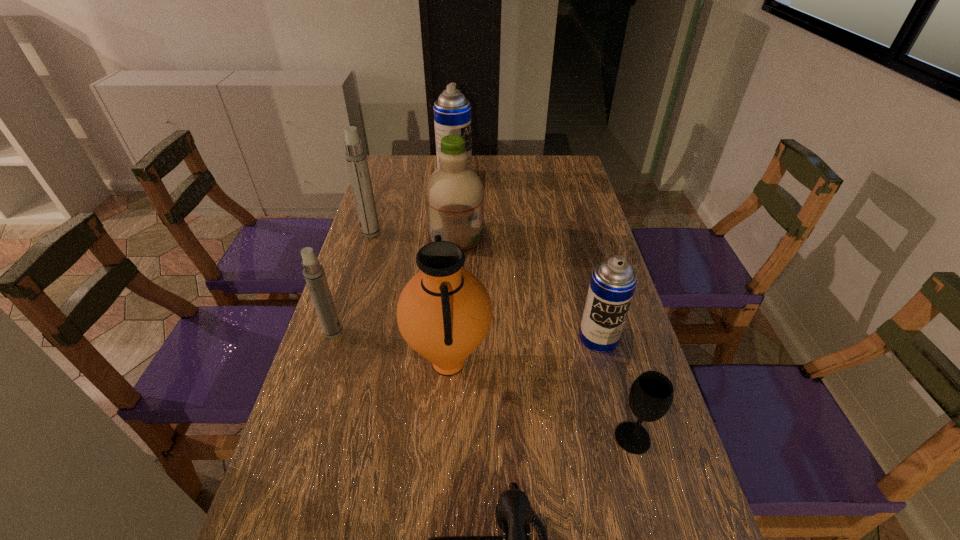
Identify the location of object that is the nearest to the pitcher. This screenshot has width=960, height=540. (313, 271).

Identify which object is located as the nearest to the farther white aerosol can. Please provide its 2D coordinates. Your answer should be formatted as a tuple, i.e. [(x, y)], where the tuple contains the x and y coordinates of a point satisfying the conditions above.

[(454, 193)]

Choose which aerosol can is the second nearest neighbor to the nearer white aerosol can. Please provide its 2D coordinates. Your answer should be formatted as a tuple, i.e. [(x, y)], where the tuple contains the x and y coordinates of a point satisfying the conditions above.

[(613, 281)]

Identify the location of aerosol can that is the third closest one to the seventh farthest object. (356, 158).

This screenshot has height=540, width=960. In order to click on vacant space that satisfies the following two spatial constraints: 1. on the label side of the farthest aerosol can; 2. on the back side of the seventh farthest object in this screenshot , I will do `click(433, 438)`.

Image resolution: width=960 pixels, height=540 pixels. Identify the location of vacant area that satisfies the following two spatial constraints: 1. on the front side of the nearer white aerosol can; 2. on the right side of the pitcher. (324, 362).